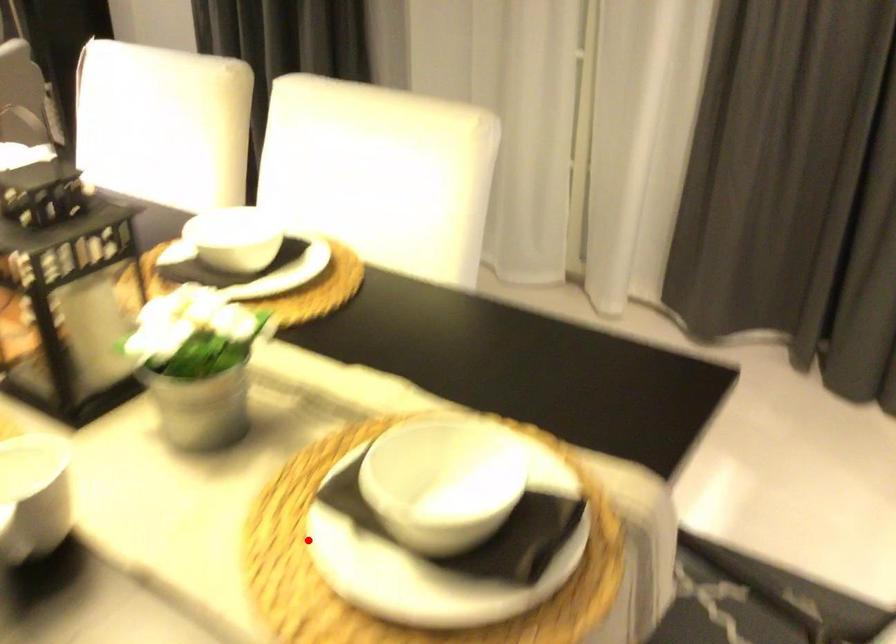
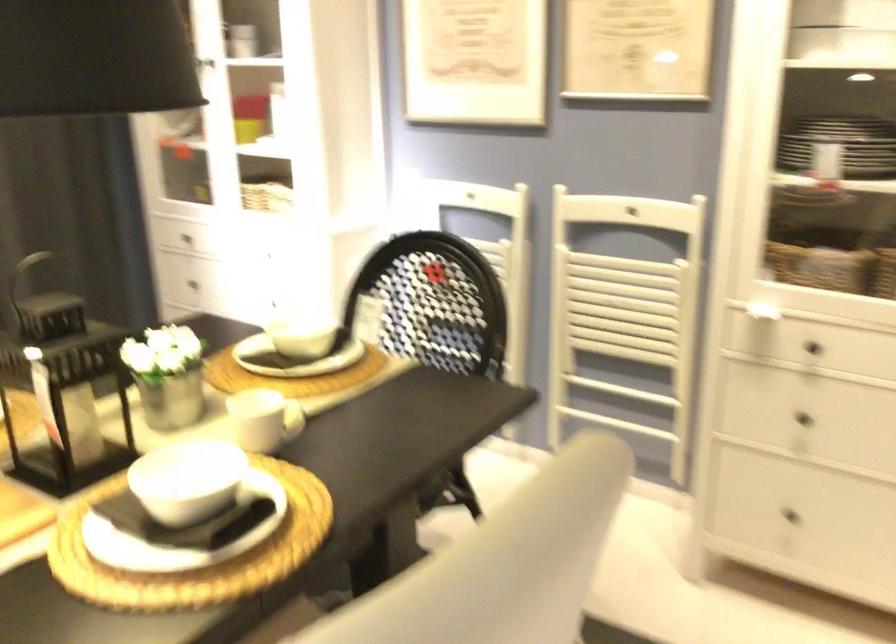
Find the pixel in the second image that matches the highlighted location in the first image.

(298, 384)